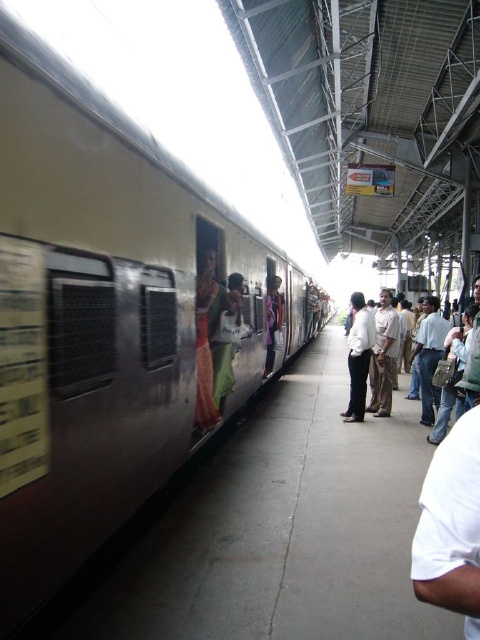
Question: Considering the real-world distances, which object is closest to the light brown leather backpack at right?

Choices:
 (A) light brown cotton shirt at center
 (B) metallic silver train at center

Answer: (A)

Question: Which of the following is the closest to the observer?

Choices:
 (A) metallic silver train at center
 (B) light brown cotton shirt at center
 (C) light brown leather backpack at right

Answer: (A)

Question: Does metallic silver train at center have a greater width compared to light brown cotton shirt at center?

Choices:
 (A) no
 (B) yes

Answer: (A)

Question: From the image, what is the correct spatial relationship of metallic silver train at center in relation to light brown leather backpack at right?

Choices:
 (A) right
 (B) left

Answer: (B)

Question: Which point appears closest to the camera in this image?

Choices:
 (A) (377, 355)
 (B) (435, 323)

Answer: (B)

Question: Can you confirm if metallic silver train at center is positioned to the right of light brown cotton shirt at center?

Choices:
 (A) yes
 (B) no

Answer: (B)